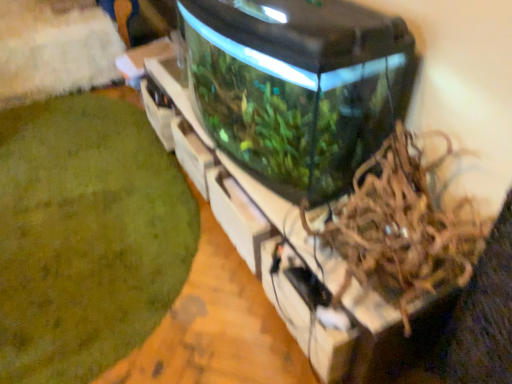
What do you see at coordinates (298, 87) in the screenshot? I see `transparent glass water tank at center` at bounding box center [298, 87].

I want to click on transparent glass water tank at center, so click(x=298, y=87).

Considering the positions of points (27, 359) and (481, 231), is point (27, 359) farther from camera compared to point (481, 231)?

Yes, point (27, 359) is farther from viewer.

Between green moss at lower left and brown shredded paper at center-right, which one has more height?

brown shredded paper at center-right is taller.

Are green moss at lower left and brown shredded paper at center-right far apart?

green moss at lower left is actually quite close to brown shredded paper at center-right.

From the picture: Is green moss at lower left not within brown shredded paper at center-right?

Absolutely, green moss at lower left is external to brown shredded paper at center-right.

Which is less distant, (144, 251) or (202, 115)?

Point (144, 251) is closer to the camera than point (202, 115).

This screenshot has width=512, height=384. I want to click on water tank above the green moss at lower left (from the image's perspective), so click(x=298, y=87).

Considering the sizes of green moss at lower left and transparent glass water tank at center in the image, is green moss at lower left bigger or smaller than transparent glass water tank at center?

In the image, green moss at lower left appears to be smaller than transparent glass water tank at center.

From a real-world perspective, is green moss at lower left beneath transparent glass water tank at center?

Indeed, from a real-world perspective, green moss at lower left is positioned beneath transparent glass water tank at center.

Is the surface of transparent glass water tank at center in direct contact with brown shredded paper at center-right?

No, transparent glass water tank at center is not next to brown shredded paper at center-right.

Is brown shredded paper at center-right at the back of transparent glass water tank at center?

No, transparent glass water tank at center's orientation is not away from brown shredded paper at center-right.

Which is closer, (317, 21) or (422, 278)?

Clearly, point (317, 21) is more distant from the camera than point (422, 278).

Considering the relative positions of transparent glass water tank at center and green moss at lower left in the image provided, is transparent glass water tank at center to the right of green moss at lower left from the viewer's perspective?

Yes, transparent glass water tank at center is to the right of green moss at lower left.

Looking at this image, is transparent glass water tank at center bigger or smaller than green moss at lower left?

Considering their sizes, transparent glass water tank at center takes up more space than green moss at lower left.

How different are the orientations of transparent glass water tank at center and green moss at lower left in degrees?

They differ by 91.1 degrees in their facing directions.

Is transparent glass water tank at center facing away from green moss at lower left?

No, green moss at lower left is not at the back of transparent glass water tank at center.

From their relative heights in the image, would you say brown shredded paper at center-right is taller or shorter than transparent glass water tank at center?

Clearly, brown shredded paper at center-right is shorter compared to transparent glass water tank at center.

Based on the photo, is brown shredded paper at center-right oriented towards transparent glass water tank at center?

No, brown shredded paper at center-right is not oriented towards transparent glass water tank at center.

Is point (381, 179) behind point (297, 187)?

No, (381, 179) is closer to viewer.

Is brown shredded paper at center-right taller or shorter than green moss at lower left?

brown shredded paper at center-right is taller than green moss at lower left.

Is brown shredded paper at center-right touching green moss at lower left?

No, brown shredded paper at center-right is not beside green moss at lower left.

Considering the relative positions of brown shredded paper at center-right and green moss at lower left in the image provided, is brown shredded paper at center-right in front of green moss at lower left?

Yes.

This screenshot has width=512, height=384. I want to click on bird nest in front of the green moss at lower left, so click(402, 228).

Where is `water tank on the right of green moss at lower left`? water tank on the right of green moss at lower left is located at coordinates (298, 87).

Which object lies further to the anchor point brown shredded paper at center-right, transparent glass water tank at center or green moss at lower left?

green moss at lower left is further to brown shredded paper at center-right.

Based on their spatial positions, is transparent glass water tank at center or brown shredded paper at center-right closer to green moss at lower left?

Among the two, transparent glass water tank at center is located nearer to green moss at lower left.

Based on the photo, from the image, which object appears to be nearer to brown shredded paper at center-right, green moss at lower left or transparent glass water tank at center?

transparent glass water tank at center lies closer to brown shredded paper at center-right than the other object.

Considering their positions, is brown shredded paper at center-right positioned closer to transparent glass water tank at center than green moss at lower left?

Among the two, brown shredded paper at center-right is located nearer to transparent glass water tank at center.

Based on their spatial positions, is brown shredded paper at center-right or transparent glass water tank at center further from green moss at lower left?

Based on the image, brown shredded paper at center-right appears to be further to green moss at lower left.

When comparing their distances from transparent glass water tank at center, does green moss at lower left or brown shredded paper at center-right seem closer?

brown shredded paper at center-right lies closer to transparent glass water tank at center than the other object.

Locate an element on the screen. The height and width of the screenshot is (384, 512). water tank situated between green moss at lower left and brown shredded paper at center-right from left to right is located at coordinates (298, 87).